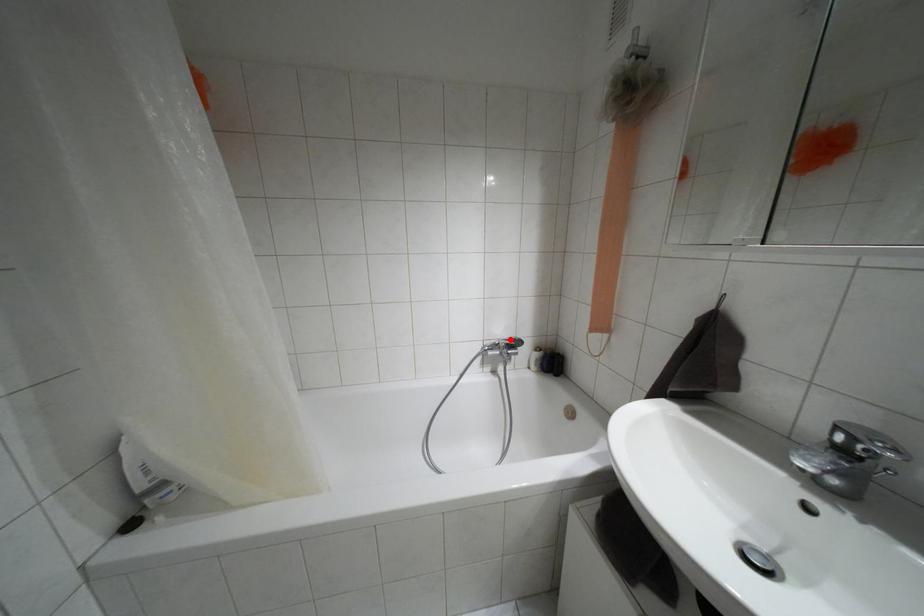
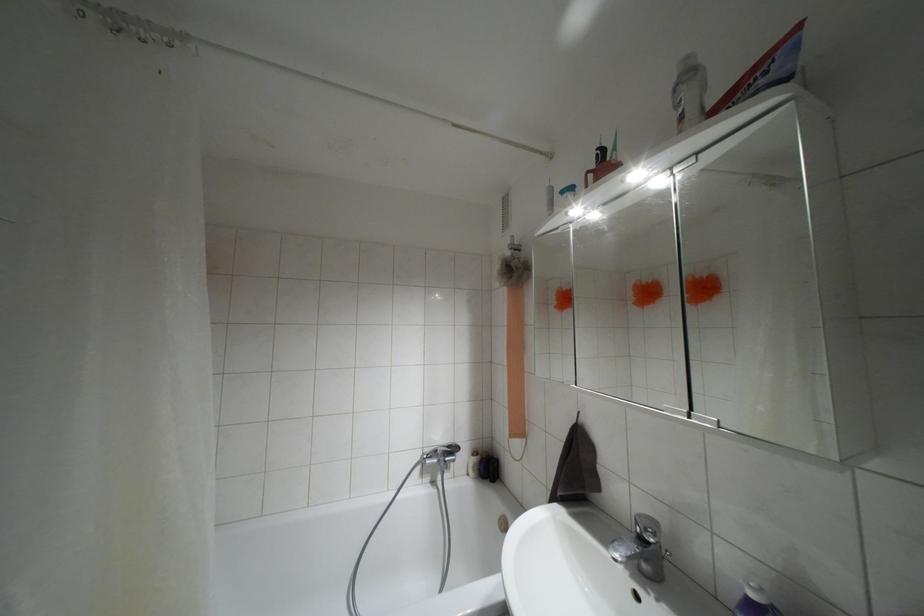
Question: I am providing you with two images of the same scene from different viewpoints. In image1, a red point is highlighted. Considering the same 3D point in image2, which of the following is correct?

Choices:
 (A) It is closer
 (B) It is farther

Answer: (B)